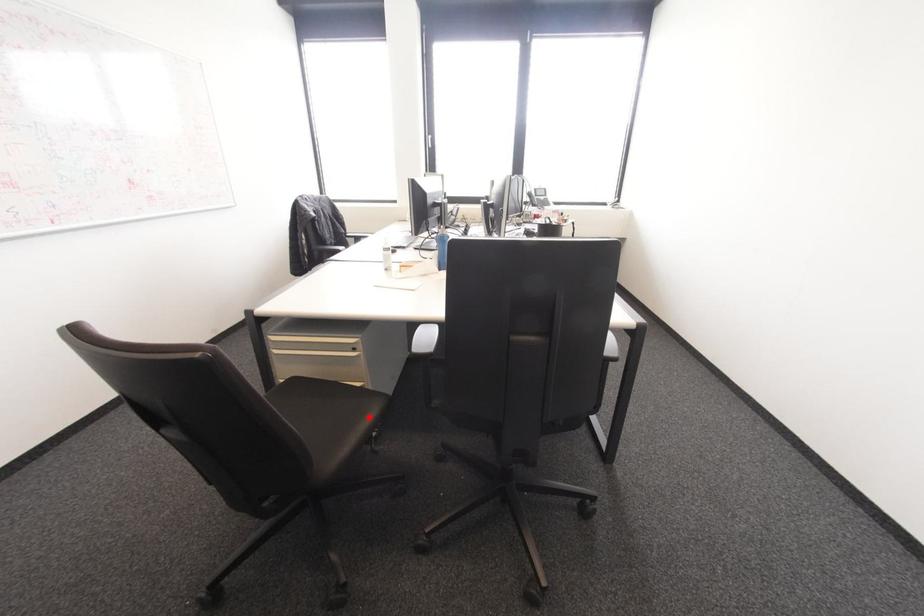
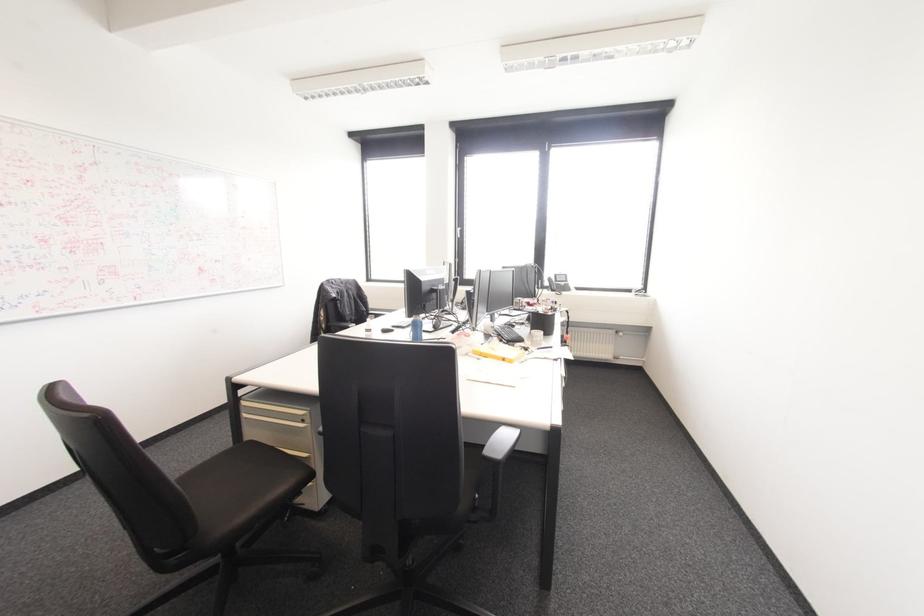
Question: I am providing you with two images of the same scene from different viewpoints. Given a red point in image1, look at the same physical point in image2. Is it:

Choices:
 (A) Closer to the viewpoint
 (B) Farther from the viewpoint

Answer: (B)